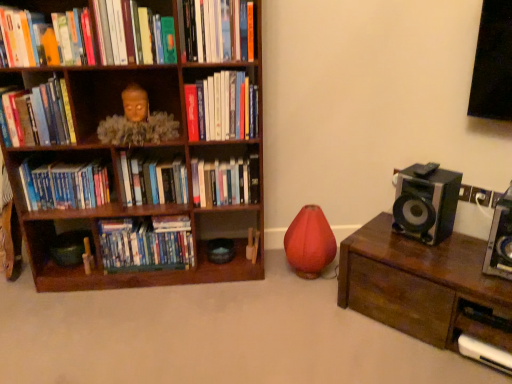
At what (x,y) coordinates should I click in order to perform the action: click on vacant space situated on the left part of wooden chest at right. Please return your answer as a coordinate pair (x, y). The height and width of the screenshot is (384, 512). Looking at the image, I should click on click(314, 324).